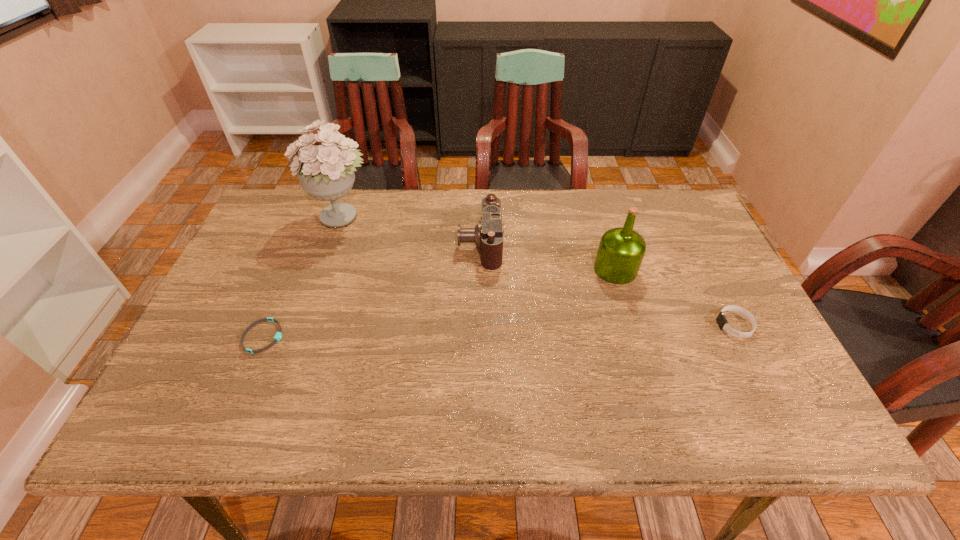
You are a GUI agent. You are given a task and a screenshot of the screen. Output one action in this format:
    pyautogui.click(x=<x>, y=<y>)
    Task: Click on the bouquet located in the left edge section of the desktop
    Image resolution: width=960 pixels, height=540 pixels.
    Given the screenshot: What is the action you would take?
    pyautogui.click(x=326, y=172)

This screenshot has width=960, height=540. I want to click on wristband present at the left edge, so click(278, 335).

Locate an element on the screen. This screenshot has width=960, height=540. object that is at the right edge is located at coordinates (722, 322).

The height and width of the screenshot is (540, 960). I want to click on object present at the far left corner, so click(326, 172).

Locate an element on the screen. vacant area at the far edge is located at coordinates (381, 203).

The height and width of the screenshot is (540, 960). Find the location of `vacant space at the near edge of the desktop`. vacant space at the near edge of the desktop is located at coordinates (591, 413).

The image size is (960, 540). What are the coordinates of `vacant space at the left edge` in the screenshot? It's located at (x=251, y=314).

The width and height of the screenshot is (960, 540). In order to click on free space at the right edge of the desktop in this screenshot , I will do `click(684, 269)`.

This screenshot has height=540, width=960. What are the coordinates of `vacant space at the far left corner of the desktop` in the screenshot? It's located at (267, 230).

Where is `free space at the near left corner of the desktop`? This screenshot has height=540, width=960. free space at the near left corner of the desktop is located at coordinates coord(220,435).